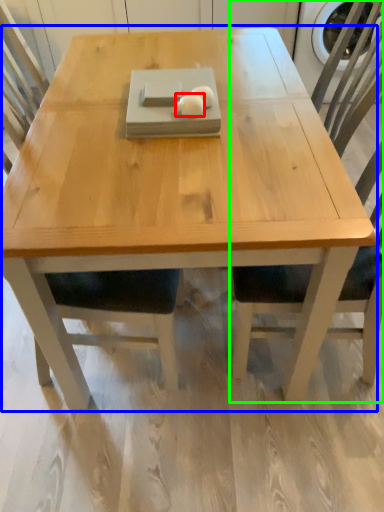
Question: Which object is the farthest from food (highlighted by a red box)? Choose among these: coffee table (highlighted by a blue box) or chair (highlighted by a green box).

Choices:
 (A) coffee table
 (B) chair

Answer: (B)